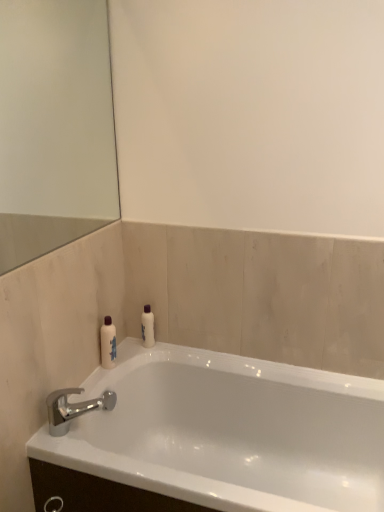
Question: From a real-world perspective, does white glossy bottle at left, which is the 2th toiletry from back to front, stand above white glossy bottle at upper center, the first toiletry positioned from the right?

Choices:
 (A) no
 (B) yes

Answer: (B)

Question: Is white glossy bottle at left, the 2th toiletry when ordered from right to left, facing towards white glossy bottle at upper center, which ranks as the 2th toiletry in left-to-right order?

Choices:
 (A) yes
 (B) no

Answer: (B)

Question: Is white glossy bottle at left, which is the 2th toiletry from back to front, closer to the viewer compared to white glossy bottle at upper center, which ranks as the 2th toiletry in left-to-right order?

Choices:
 (A) no
 (B) yes

Answer: (B)

Question: From a real-world perspective, does white glossy bottle at left, the 2th toiletry when ordered from right to left, sit lower than white glossy bottle at upper center, the first toiletry positioned from the back?

Choices:
 (A) yes
 (B) no

Answer: (B)

Question: From the image's perspective, does white glossy bottle at left, the first toiletry in the left-to-right sequence, appear higher than white glossy bottle at upper center, the first toiletry positioned from the right?

Choices:
 (A) yes
 (B) no

Answer: (B)

Question: Does white glossy bottle at left, the first toiletry in the left-to-right sequence, contain white glossy bottle at upper center, arranged as the 2th toiletry when viewed from the front?

Choices:
 (A) yes
 (B) no

Answer: (B)

Question: Does white glossy bathtub at lower left appear on the right side of white glossy bottle at left, which appears as the 1th toiletry when viewed from the front?

Choices:
 (A) yes
 (B) no

Answer: (A)

Question: Is white glossy bathtub at lower left wider than white glossy bottle at left, which appears as the 1th toiletry when viewed from the front?

Choices:
 (A) no
 (B) yes

Answer: (B)

Question: Is white glossy bathtub at lower left closer to camera compared to white glossy bottle at left, which appears as the 1th toiletry when viewed from the front?

Choices:
 (A) yes
 (B) no

Answer: (A)

Question: Is white glossy bathtub at lower left directly adjacent to white glossy bottle at left, which is the 2th toiletry from back to front?

Choices:
 (A) no
 (B) yes

Answer: (A)

Question: Is white glossy bottle at left, which is the 2th toiletry from back to front, a part of white glossy bathtub at lower left?

Choices:
 (A) no
 (B) yes

Answer: (A)

Question: Is white glossy bathtub at lower left taller than white glossy bottle at left, the first toiletry in the left-to-right sequence?

Choices:
 (A) yes
 (B) no

Answer: (A)

Question: Does chrome metallic faucet at lower left have a lesser width compared to white glossy bathtub at lower left?

Choices:
 (A) no
 (B) yes

Answer: (B)